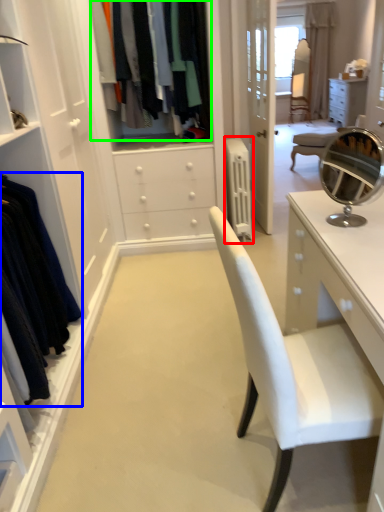
Question: Based on their relative distances, which object is farther from radiator (highlighted by a red box)? Choose from clothing (highlighted by a blue box) and clothing (highlighted by a green box).

Choices:
 (A) clothing
 (B) clothing

Answer: (A)